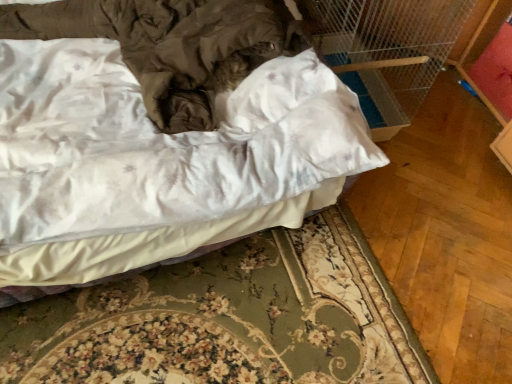
Identify the location of vacant area situated below white fabric bed frame at lower center (from a real-world perspective). (256, 327).